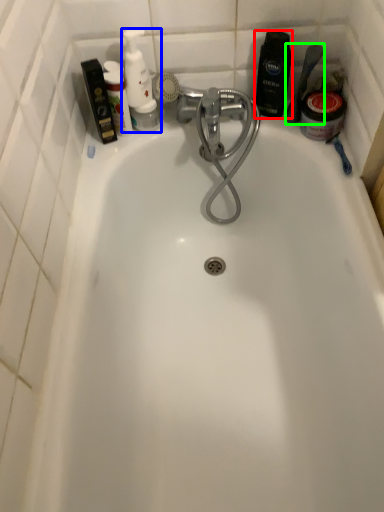
Question: Considering the real-world distances, which object is farthest from toiletry (highlighted by a red box)? toiletry (highlighted by a blue box) or shower (highlighted by a green box)?

Choices:
 (A) toiletry
 (B) shower

Answer: (A)